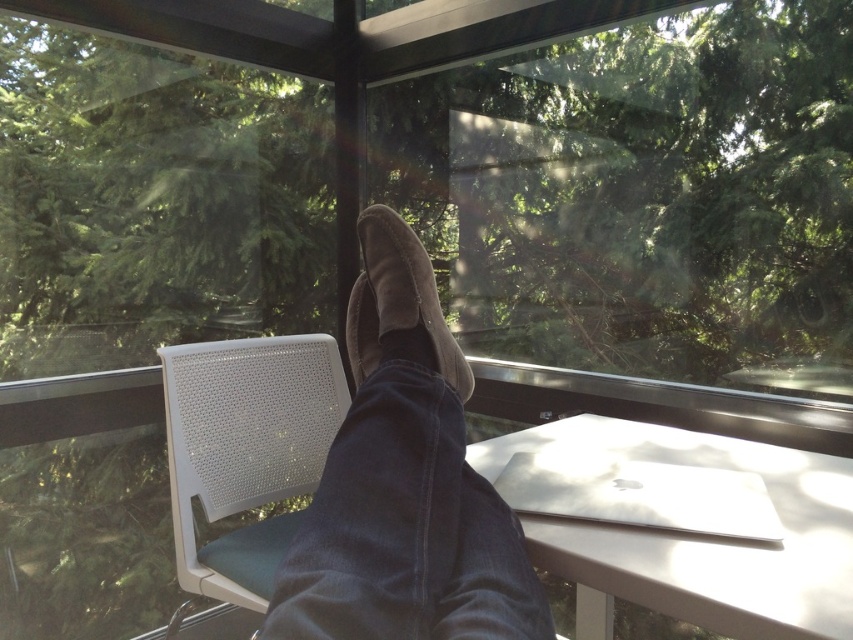
Between white mesh chair at left and suede-like brown shoe at center, which one has less height?

Standing shorter between the two is suede-like brown shoe at center.

Is white mesh chair at left positioned before suede-like brown shoe at center?

No.

The height and width of the screenshot is (640, 853). What do you see at coordinates (245, 451) in the screenshot? I see `white mesh chair at left` at bounding box center [245, 451].

At what (x,y) coordinates should I click in order to perform the action: click on white mesh chair at left. Please return your answer as a coordinate pair (x, y). The height and width of the screenshot is (640, 853). Looking at the image, I should click on (245, 451).

Who is lower down, brown suede shoes at center or white glossy table at lower right?

white glossy table at lower right is below.

Between brown suede shoes at center and white glossy table at lower right, which one has less height?

With less height is white glossy table at lower right.

You are a GUI agent. You are given a task and a screenshot of the screen. Output one action in this format:
    pyautogui.click(x=<x>, y=<y>)
    Task: Click on the brown suede shoes at center
    Image resolution: width=853 pixels, height=640 pixels.
    Given the screenshot: What is the action you would take?
    pyautogui.click(x=404, y=483)

Is brown suede shoes at center in front of suede-like brown shoe at center?

Yes, brown suede shoes at center is in front of suede-like brown shoe at center.

The width and height of the screenshot is (853, 640). What do you see at coordinates (404, 483) in the screenshot? I see `brown suede shoes at center` at bounding box center [404, 483].

Which is in front, point (479, 548) or point (358, 376)?

Positioned in front is point (479, 548).

The image size is (853, 640). In order to click on brown suede shoes at center in this screenshot , I will do `click(404, 483)`.